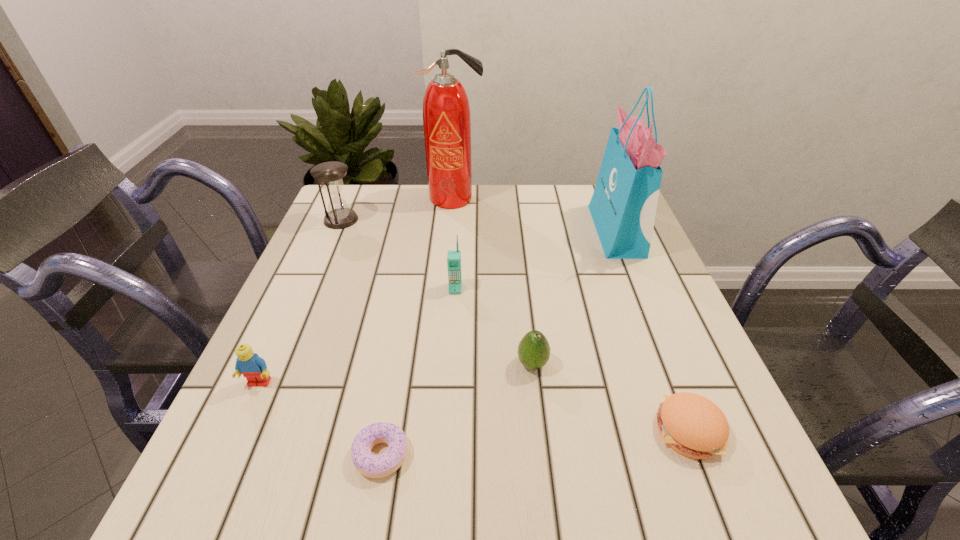
Locate an element on the screen. free space between the fifth nearest object and the seventh tallest object is located at coordinates (572, 359).

Find the location of `vacant area that lies between the patty and the hourglass`. vacant area that lies between the patty and the hourglass is located at coordinates (515, 325).

Find the location of `free space between the fourth farthest object and the fire extinguisher`. free space between the fourth farthest object and the fire extinguisher is located at coordinates (455, 244).

Select which object appears as the closest to the Lego. Please provide its 2D coordinates. Your answer should be formatted as a tuple, i.e. [(x, y)], where the tuple contains the x and y coordinates of a point satisfying the conditions above.

[(374, 466)]

Point out which object is positioned as the second nearest to the hourglass. Please provide its 2D coordinates. Your answer should be formatted as a tuple, i.e. [(x, y)], where the tuple contains the x and y coordinates of a point satisfying the conditions above.

[(453, 256)]

Find the location of a particular element. The height and width of the screenshot is (540, 960). vacant area in the image that satisfies the following two spatial constraints: 1. on the keypad of the avocado; 2. on the left side of the cellular telephone is located at coordinates (450, 364).

Where is `free space that satisfies the following two spatial constraints: 1. on the face of the Lego; 2. on the left side of the shortest object`? The height and width of the screenshot is (540, 960). free space that satisfies the following two spatial constraints: 1. on the face of the Lego; 2. on the left side of the shortest object is located at coordinates (227, 455).

Locate an element on the screen. vacant region that satisfies the following two spatial constraints: 1. on the front side of the hourglass; 2. on the right side of the avocado is located at coordinates (279, 364).

At what (x,y) coordinates should I click in order to perform the action: click on vacant area in the image that satisfies the following two spatial constraints: 1. on the face of the doughnut; 2. on the right side of the Lego. Please return your answer as a coordinate pair (x, y). Looking at the image, I should click on (227, 455).

Locate an element on the screen. The width and height of the screenshot is (960, 540). free space that satisfies the following two spatial constraints: 1. on the front side of the fire extinguisher; 2. on the right side of the sixth object from left to right is located at coordinates (440, 364).